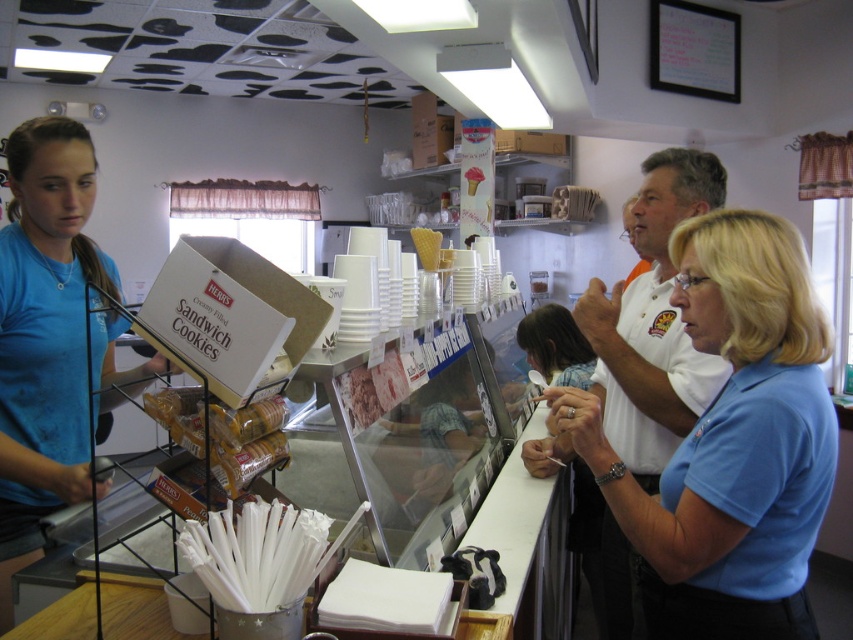
Between blue cotton shirt at center and blue cotton shirt at left, which one is positioned higher?

blue cotton shirt at left is higher up.

Which is behind, point (801, 256) or point (86, 458)?

Positioned behind is point (86, 458).

Locate an element on the screen. blue cotton shirt at center is located at coordinates (732, 444).

Can you confirm if blue cotton shirt at left is positioned below golden brown sandwich cookies at center?

Incorrect, blue cotton shirt at left is not positioned below golden brown sandwich cookies at center.

Which is behind, point (15, 193) or point (169, 394)?

Point (15, 193)

From the picture: Who is more distant from viewer, (22, 276) or (171, 413)?

The point (22, 276) is more distant.

This screenshot has width=853, height=640. Identify the location of blue cotton shirt at left. (45, 336).

Does blue cotton shirt at center appear under golden brown sandwich cookies at center?

Yes, blue cotton shirt at center is below golden brown sandwich cookies at center.

Who is positioned more to the right, blue cotton shirt at center or golden brown sandwich cookies at center?

blue cotton shirt at center is more to the right.

Is point (698, 609) farther from viewer compared to point (247, 481)?

Yes, point (698, 609) is behind point (247, 481).

You are a GUI agent. You are given a task and a screenshot of the screen. Output one action in this format:
    pyautogui.click(x=<x>, y=<y>)
    Task: Click on the blue cotton shirt at center
    The height and width of the screenshot is (640, 853).
    Given the screenshot: What is the action you would take?
    pyautogui.click(x=732, y=444)